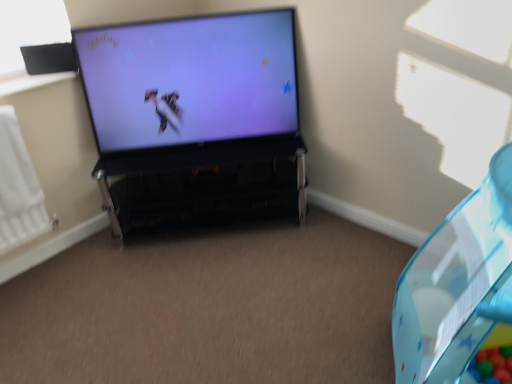
Question: Would you say matte black television at center is to the left or to the right of black glossy tv stand at center in the picture?

Choices:
 (A) left
 (B) right

Answer: (A)

Question: From a real-world perspective, relative to black glossy tv stand at center, is matte black television at center vertically above or below?

Choices:
 (A) above
 (B) below

Answer: (A)

Question: Which object is positioned farthest from the white matte radiator at left?

Choices:
 (A) matte black television at center
 (B) transparent plastic bean bag chair at right
 (C) black glossy tv stand at center
 (D) black matte speaker at upper left

Answer: (B)

Question: Which object is positioned closest to the transparent plastic bean bag chair at right?

Choices:
 (A) black matte speaker at upper left
 (B) black glossy tv stand at center
 (C) white matte radiator at left
 (D) matte black television at center

Answer: (B)